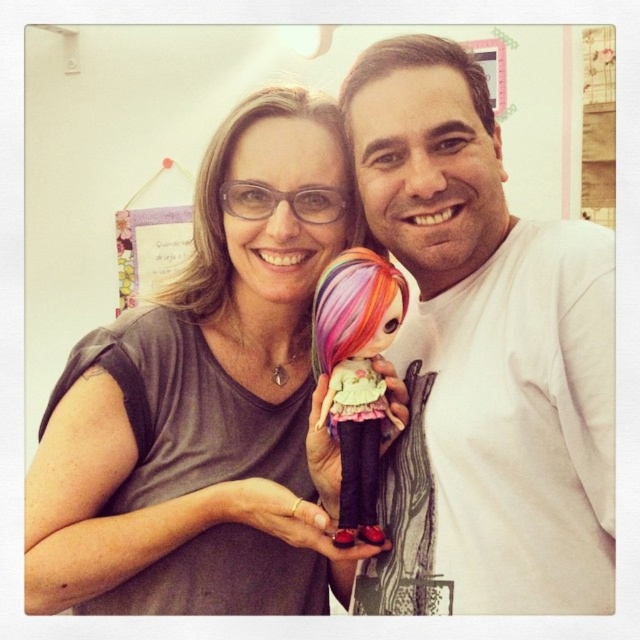
From the picture: Can you confirm if white matte shirt at center is bigger than blonde hair at upper center?

Yes, white matte shirt at center is bigger than blonde hair at upper center.

Which is more to the left, white matte shirt at center or blonde hair at upper center?

blonde hair at upper center is more to the left.

Between point (531, 468) and point (214, 208), which one is positioned in front?

Point (531, 468) is in front.

Where is `white matte shirt at center`? white matte shirt at center is located at coordinates (484, 353).

In the scene shown: Between matte gray shirt at center and rainbow hair doll at center, which one appears on the right side from the viewer's perspective?

rainbow hair doll at center

Which is in front, point (93, 352) or point (371, 266)?

Point (371, 266) is more forward.

Is point (186, 609) closer to viewer compared to point (372, 291)?

No.

Find the location of `matte gray shirt at center`. matte gray shirt at center is located at coordinates (205, 401).

Between rainbow hair doll at center and blonde hair at upper center, which one is positioned higher?

Positioned higher is blonde hair at upper center.

Which of these two, rainbow hair doll at center or blonde hair at upper center, stands shorter?

With less height is blonde hair at upper center.

Between point (339, 314) and point (208, 272), which one is positioned in front?

Point (339, 314) is in front.

Identify the location of rainbow hair doll at center. The image size is (640, 640). (356, 376).